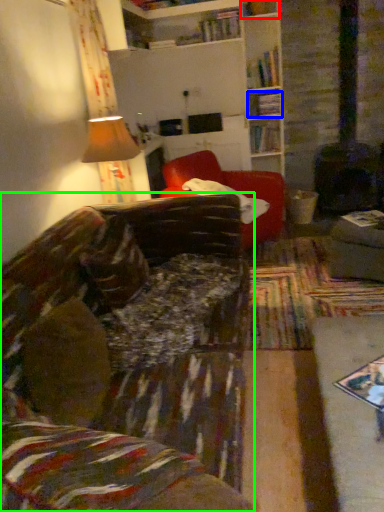
Question: Considering the real-world distances, which object is closest to shelf (highlighted by a red box)? shelf (highlighted by a blue box) or studio couch (highlighted by a green box).

Choices:
 (A) shelf
 (B) studio couch

Answer: (A)